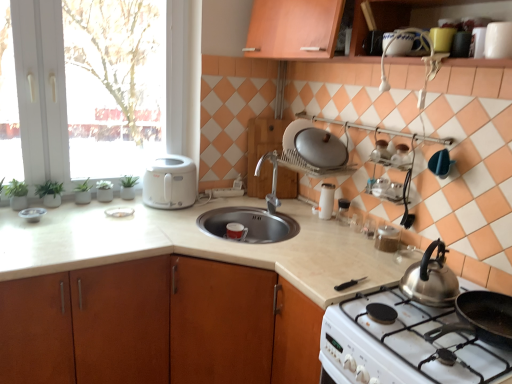
Question: Should I look upward or downward to see green matte plant at left?

Choices:
 (A) down
 (B) up

Answer: (A)

Question: Is white glossy gas stove at lower right facing towards white glossy coffee cup at upper right, acting as the first appliance starting from the top?

Choices:
 (A) no
 (B) yes

Answer: (A)

Question: From the image's perspective, is white glossy gas stove at lower right below white glossy coffee cup at upper right, which is counted as the first appliance, starting from the front?

Choices:
 (A) yes
 (B) no

Answer: (A)

Question: Can you confirm if white glossy gas stove at lower right is positioned to the left of white glossy coffee cup at upper right, acting as the first appliance starting from the top?

Choices:
 (A) no
 (B) yes

Answer: (B)

Question: Is white glossy gas stove at lower right located outside white glossy coffee cup at upper right, which is counted as the first appliance, starting from the front?

Choices:
 (A) no
 (B) yes

Answer: (B)

Question: From the image's perspective, is white glossy gas stove at lower right above white glossy coffee cup at upper right, placed as the 6th appliance when sorted from left to right?

Choices:
 (A) no
 (B) yes

Answer: (A)

Question: Is white glossy gas stove at lower right bigger than white glossy coffee cup at upper right, acting as the first appliance starting from the top?

Choices:
 (A) no
 (B) yes

Answer: (B)

Question: Is wooden cutting board at center located within white glossy plate at left, acting as the 5th appliance starting from the front?

Choices:
 (A) yes
 (B) no

Answer: (B)

Question: Is white glossy plate at left, the second appliance positioned from the back, further to the viewer compared to wooden cutting board at center?

Choices:
 (A) no
 (B) yes

Answer: (A)

Question: Is white glossy plate at left, acting as the 5th appliance starting from the right, located outside wooden cutting board at center?

Choices:
 (A) yes
 (B) no

Answer: (A)

Question: Does white glossy plate at left, acting as the 5th appliance starting from the right, have a lesser height compared to wooden cutting board at center?

Choices:
 (A) no
 (B) yes

Answer: (B)

Question: Does white glossy plate at left, acting as the 5th appliance starting from the front, have a greater height compared to wooden cutting board at center?

Choices:
 (A) yes
 (B) no

Answer: (B)

Question: Is white glossy plate at left, the second appliance positioned from the back, far from wooden cutting board at center?

Choices:
 (A) yes
 (B) no

Answer: (B)

Question: Would you consider satin silver lid at upper center, which is counted as the second kitchen appliance, starting from the right, to be distant from green matte plant at left?

Choices:
 (A) no
 (B) yes

Answer: (B)